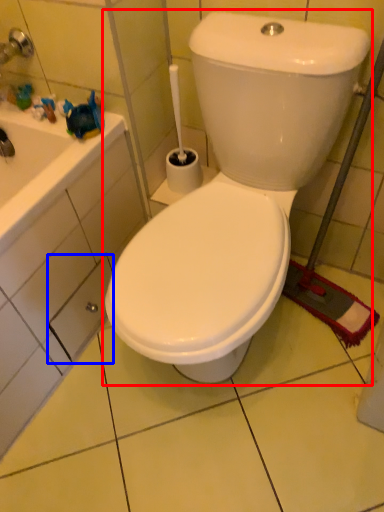
Question: Which point is further to the camera, toilet (highlighted by a red box) or drawer (highlighted by a blue box)?

Choices:
 (A) toilet
 (B) drawer

Answer: (B)